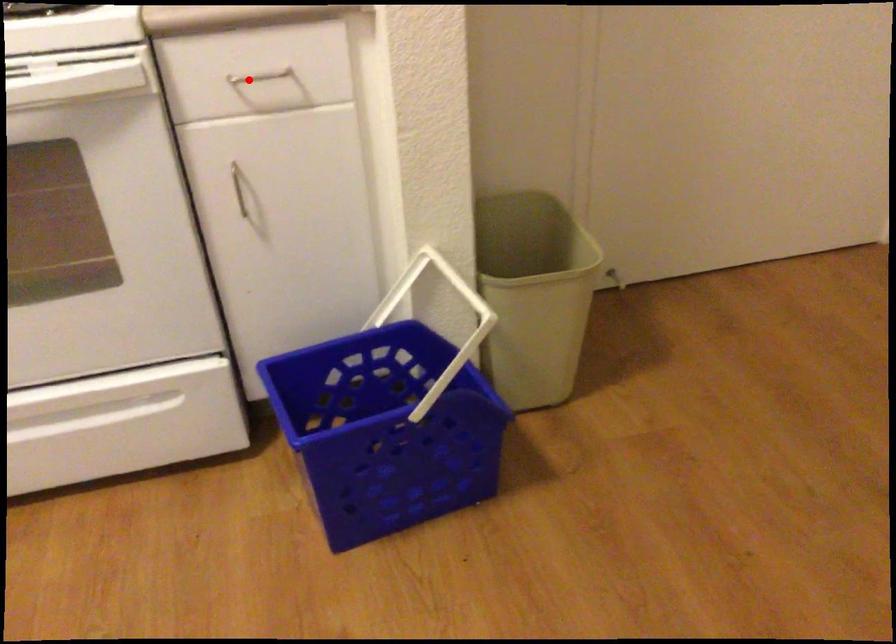
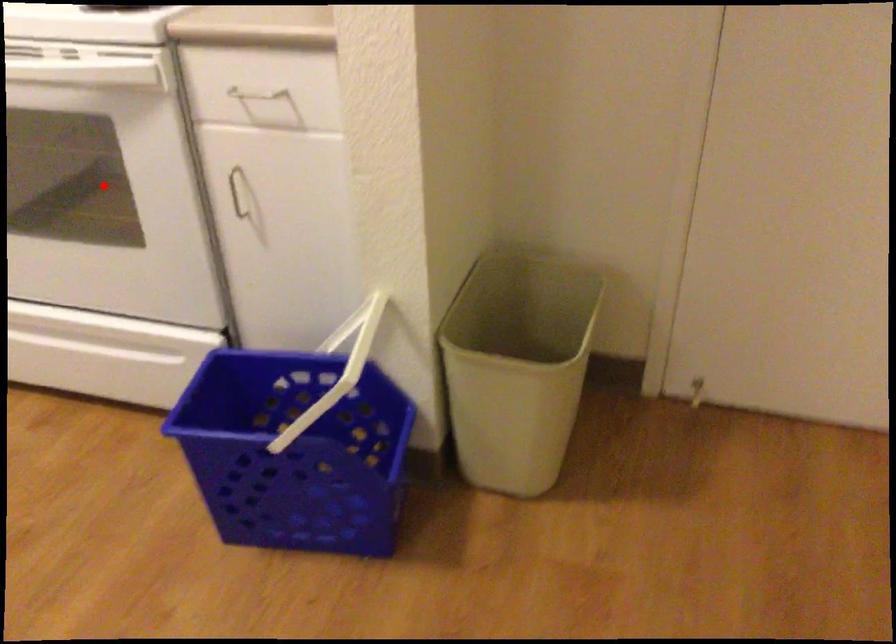
I am providing you with two images of the same scene from different viewpoints. A red point is marked on the first image and another point is marked on the second image. Is the marked point in image1 the same physical position as the marked point in image2?

No